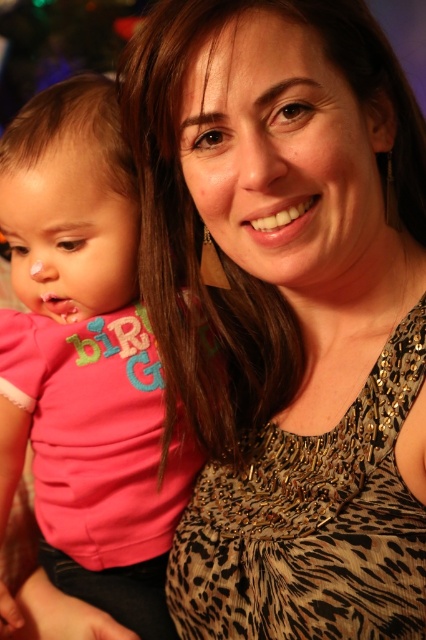
Does leopard print tank top at center come behind pink fabric shirt at left?

No, leopard print tank top at center is closer to the viewer.

Is leopard print tank top at center bigger than pink fabric shirt at left?

Indeed, leopard print tank top at center has a larger size compared to pink fabric shirt at left.

Does point (304, 369) come in front of point (118, 385)?

Yes.

I want to click on leopard print tank top at center, so click(285, 310).